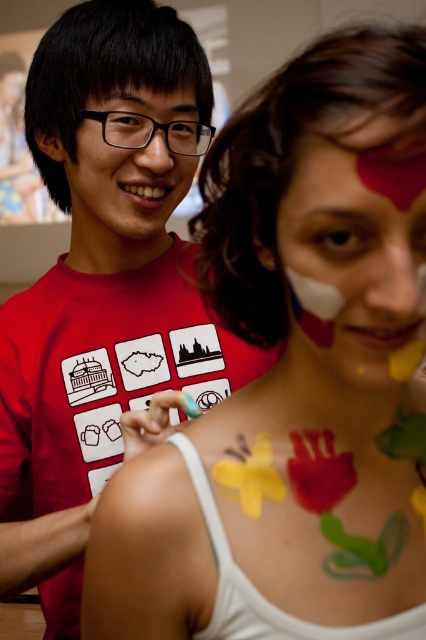
Which of these two, matte red t-shirt at upper left or matte black face at center, stands taller?

matte red t-shirt at upper left is taller.

Which is above, matte red t-shirt at upper left or matte black face at center?

matte black face at center is above.

Identify the location of matte red t-shirt at upper left. (111, 252).

Does matte red paint at center have a greater height compared to matte black face at center?

In fact, matte red paint at center may be shorter than matte black face at center.

Between matte red paint at center and matte black face at center, which one appears on the left side from the viewer's perspective?

matte black face at center is more to the left.

Where is `matte red paint at center`? matte red paint at center is located at coordinates (356, 241).

Between point (62, 604) and point (377, 252), which one is positioned in front?

Point (377, 252)

Is matte red t-shirt at upper left wider than matte red paint at center?

Yes, matte red t-shirt at upper left is wider than matte red paint at center.

Image resolution: width=426 pixels, height=640 pixels. I want to click on matte red t-shirt at upper left, so click(x=111, y=252).